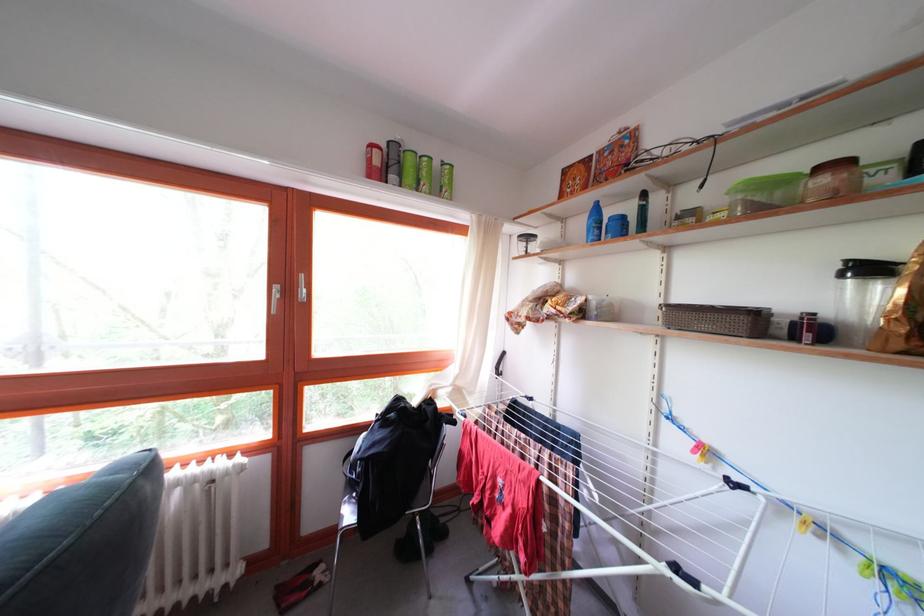
This screenshot has height=616, width=924. I want to click on green food container, so click(x=764, y=193).